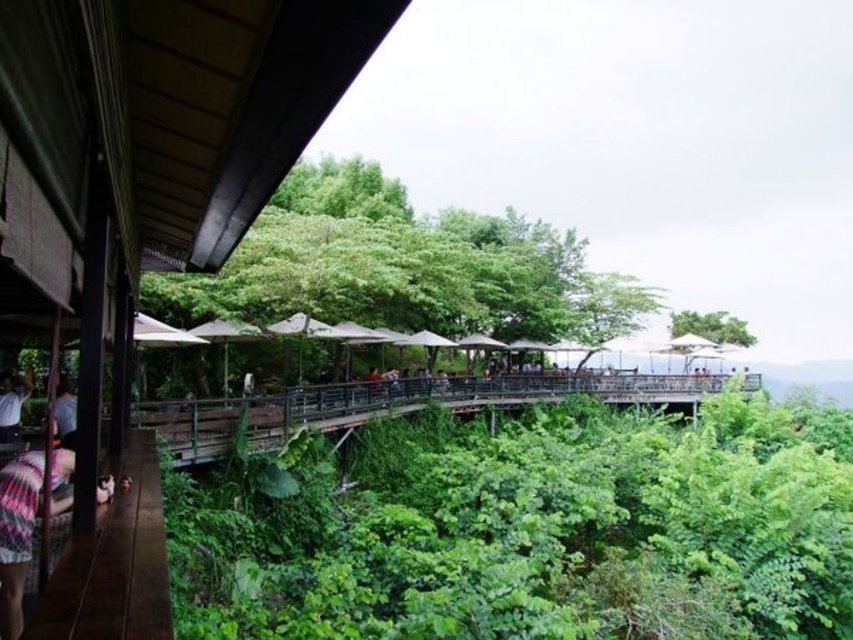
Question: Can you confirm if green leafy tree at center is bigger than green leafy tree at upper center?

Choices:
 (A) no
 (B) yes

Answer: (B)

Question: Can you confirm if green leafy vegetation at center is positioned above green leafy tree at upper center?

Choices:
 (A) no
 (B) yes

Answer: (A)

Question: Which of the following is the closest to the observer?

Choices:
 (A) (61, 396)
 (B) (732, 394)
 (C) (477, 403)
 (D) (730, 342)

Answer: (A)

Question: Is plaid fabric at lower left positioned in front of light blue shirt at left?

Choices:
 (A) no
 (B) yes

Answer: (B)

Question: Which point appears closest to the camera in this image?

Choices:
 (A) (508, 628)
 (B) (308, 406)
 (C) (413, 321)

Answer: (A)

Question: Which point appears closest to the camera in this image?

Choices:
 (A) (670, 330)
 (B) (532, 572)

Answer: (B)